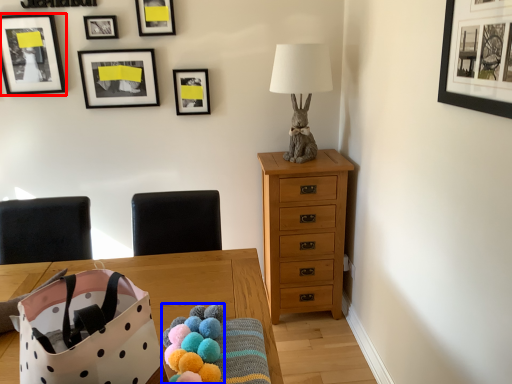
Question: Which object is further to the camera taking this photo, picture frame (highlighted by a red box) or stuff (highlighted by a blue box)?

Choices:
 (A) picture frame
 (B) stuff

Answer: (A)